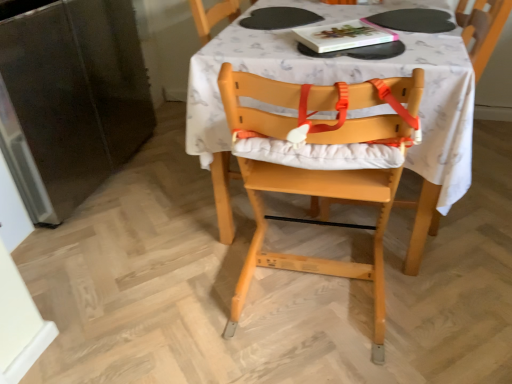
The height and width of the screenshot is (384, 512). In order to click on free spot below natural wood highchair at center (from a real-world perspective) in this screenshot , I will do `click(312, 300)`.